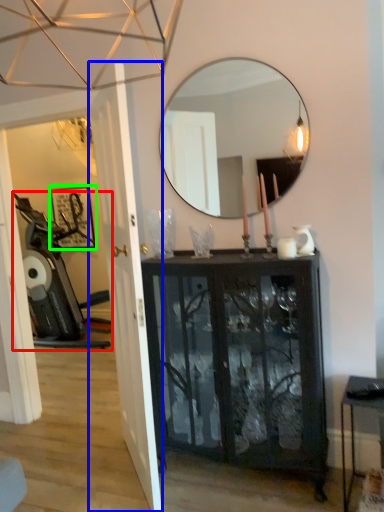
Question: Which object is positioned closest to swivel chair (highlighted by a red box)? Select from door (highlighted by a blue box) and picture frame (highlighted by a green box).

Choices:
 (A) door
 (B) picture frame

Answer: (B)